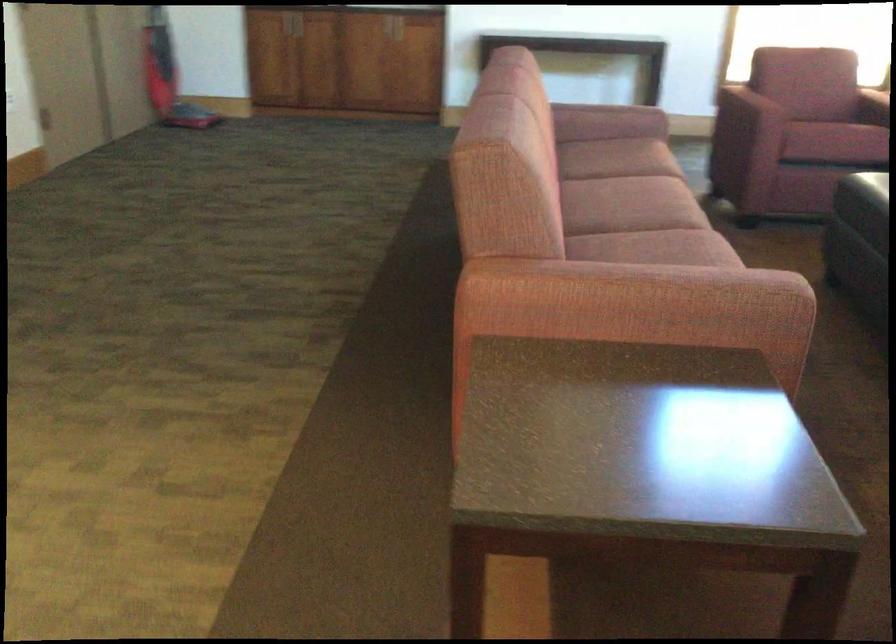
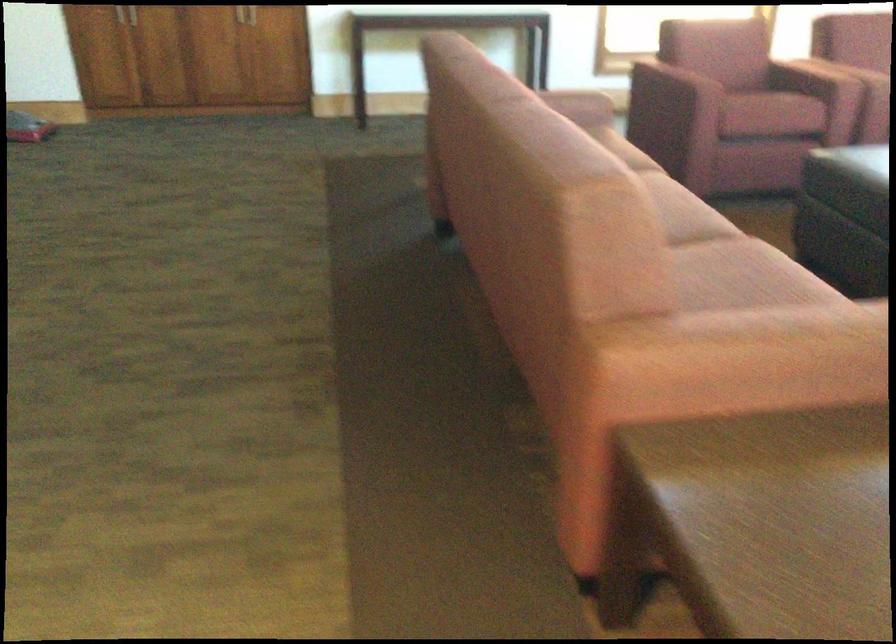
Question: Based on the continuous images, in which direction is the camera rotating? Reply with the corresponding letter.

Choices:
 (A) Left
 (B) Right
 (C) Up
 (D) Down

Answer: (B)